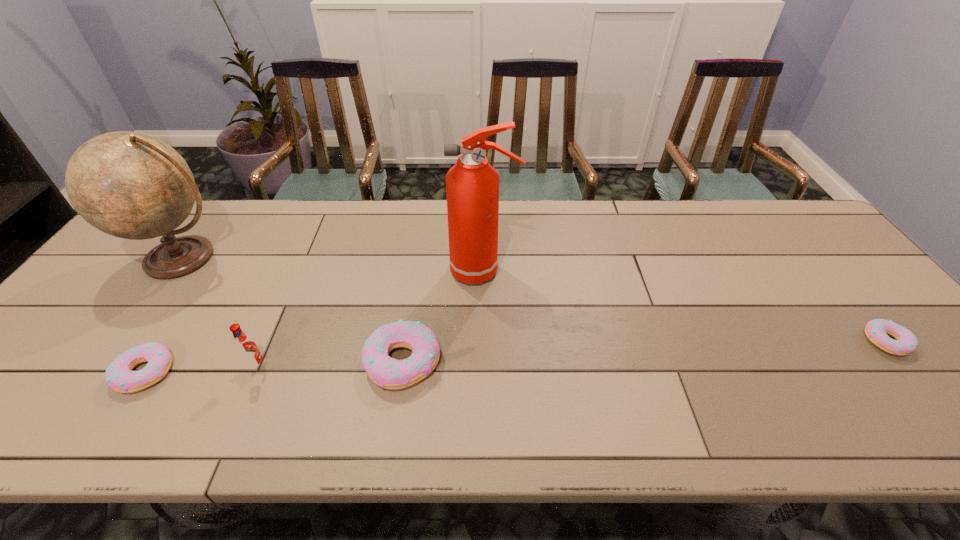
Locate an element on the screen. The width and height of the screenshot is (960, 540). the second tallest doughnut is located at coordinates (119, 376).

Locate an element on the screen. The height and width of the screenshot is (540, 960). the fifth tallest object is located at coordinates (119, 376).

Find the location of a particular element. This screenshot has width=960, height=540. the third shortest object is located at coordinates (389, 373).

I want to click on the third object from right to left, so click(389, 373).

Locate an element on the screen. The height and width of the screenshot is (540, 960). the shortest doughnut is located at coordinates (876, 330).

At what (x,y) coordinates should I click in order to perform the action: click on the rightmost doughnut. Please return your answer as a coordinate pair (x, y). This screenshot has width=960, height=540. Looking at the image, I should click on (876, 330).

Find the location of a particular element. the second object from right to left is located at coordinates (472, 185).

Identify the location of globe. (130, 185).

Where is `root beer`? This screenshot has height=540, width=960. root beer is located at coordinates point(246,348).

Image resolution: width=960 pixels, height=540 pixels. I want to click on the third tallest object, so click(x=246, y=348).